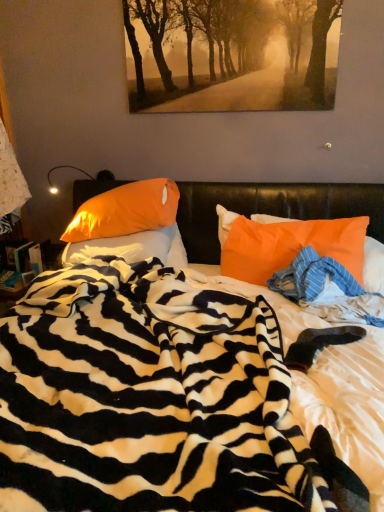
Question: Is orange fabric pillow at right, acting as the 1th pillow starting from the right, thinner than golden textured pathway at upper center?

Choices:
 (A) yes
 (B) no

Answer: (B)

Question: Is orange fabric pillow at right, acting as the 1th pillow starting from the right, behind golden textured pathway at upper center?

Choices:
 (A) no
 (B) yes

Answer: (A)

Question: From the image's perspective, is orange fabric pillow at right, acting as the 1th pillow starting from the right, located beneath golden textured pathway at upper center?

Choices:
 (A) no
 (B) yes

Answer: (B)

Question: Is orange fabric pillow at right, acting as the 1th pillow starting from the right, surrounding golden textured pathway at upper center?

Choices:
 (A) yes
 (B) no

Answer: (B)

Question: In the image, is zebra-patterned blanket at center positioned in front of or behind golden textured pathway at upper center?

Choices:
 (A) behind
 (B) front

Answer: (B)

Question: From the image's perspective, is zebra-patterned blanket at center above or below golden textured pathway at upper center?

Choices:
 (A) below
 (B) above

Answer: (A)

Question: In terms of height, does zebra-patterned blanket at center look taller or shorter compared to golden textured pathway at upper center?

Choices:
 (A) short
 (B) tall

Answer: (B)

Question: From a real-world perspective, is zebra-patterned blanket at center above or below golden textured pathway at upper center?

Choices:
 (A) below
 (B) above

Answer: (A)

Question: Considering the positions of orange satin pillow at center, which appears as the 3th pillow when viewed from the right, and golden textured pathway at upper center in the image, is orange satin pillow at center, which appears as the 3th pillow when viewed from the right, taller or shorter than golden textured pathway at upper center?

Choices:
 (A) short
 (B) tall

Answer: (A)

Question: Would you say orange satin pillow at center, which appears as the 3th pillow when viewed from the right, is to the left or to the right of golden textured pathway at upper center in the picture?

Choices:
 (A) left
 (B) right

Answer: (A)

Question: Does point (142, 256) appear closer or farther from the camera than point (223, 24)?

Choices:
 (A) farther
 (B) closer

Answer: (A)

Question: In the image, is orange satin pillow at center, which appears as the 3th pillow when viewed from the right, positioned in front of or behind golden textured pathway at upper center?

Choices:
 (A) behind
 (B) front

Answer: (A)

Question: Is zebra-patterned blanket at center wider or thinner than blue striped fabric at center?

Choices:
 (A) wide
 (B) thin

Answer: (A)

Question: Is zebra-patterned blanket at center bigger or smaller than blue striped fabric at center?

Choices:
 (A) big
 (B) small

Answer: (A)